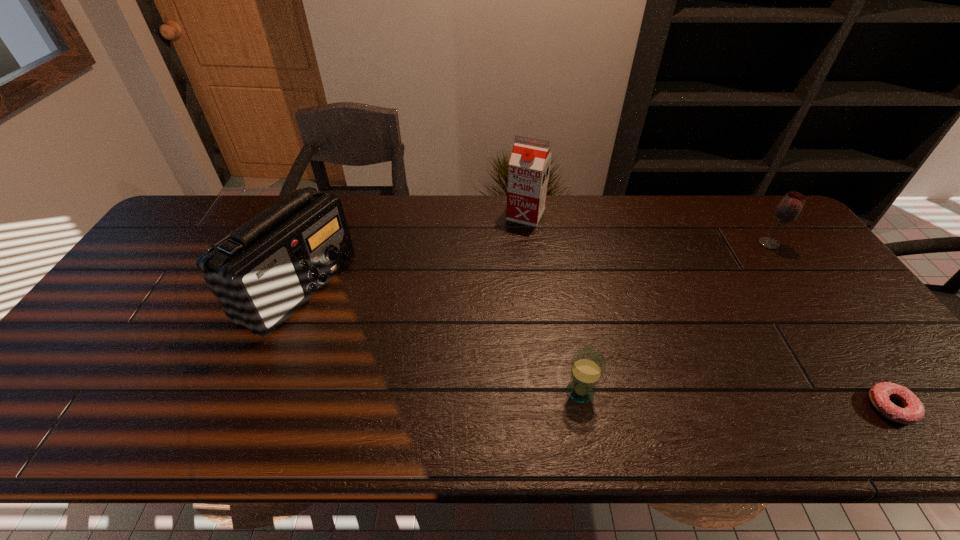
I want to click on soya milk, so click(x=528, y=172).

Identify the location of radio receiver. Image resolution: width=960 pixels, height=540 pixels. tap(261, 273).

Identify the location of the taller glass. The height and width of the screenshot is (540, 960). (789, 208).

What are the coordinates of `the farther glass` in the screenshot? It's located at (789, 208).

Identify the location of the second shortest object. Image resolution: width=960 pixels, height=540 pixels. (587, 365).

You are a GUI agent. You are given a task and a screenshot of the screen. Output one action in this format:
    pyautogui.click(x=<x>, y=<y>)
    Task: Click on the shorter glass
    This screenshot has width=960, height=540.
    Given the screenshot: What is the action you would take?
    [x=587, y=365]

Find the location of `doughnut`. doughnut is located at coordinates (913, 410).

Where is `free region located on the left of the farthest object`? This screenshot has height=540, width=960. free region located on the left of the farthest object is located at coordinates (491, 215).

Identify the location of free space located 0.180m on the front panel of the leftmost object. (412, 288).

You are a GUI agent. You are given a task and a screenshot of the screen. Output one action in this format:
    pyautogui.click(x=<x>, y=<y>)
    Task: Click on the free space located on the back of the farther glass
    This screenshot has width=960, height=540.
    Given the screenshot: What is the action you would take?
    pyautogui.click(x=740, y=204)